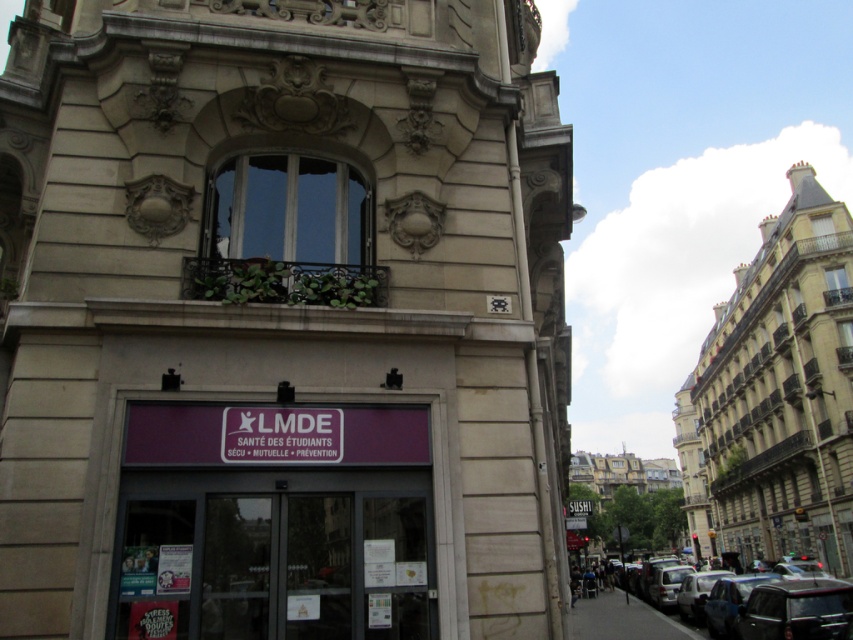
Question: Does beige stone tower at center appear over metallic silver car at lower right?

Choices:
 (A) no
 (B) yes

Answer: (B)

Question: Where is beige stone tower at center located in relation to metallic silver car at lower right in the image?

Choices:
 (A) left
 (B) right

Answer: (A)

Question: Does beige stone tower at center have a smaller size compared to metallic silver car at lower right?

Choices:
 (A) yes
 (B) no

Answer: (A)